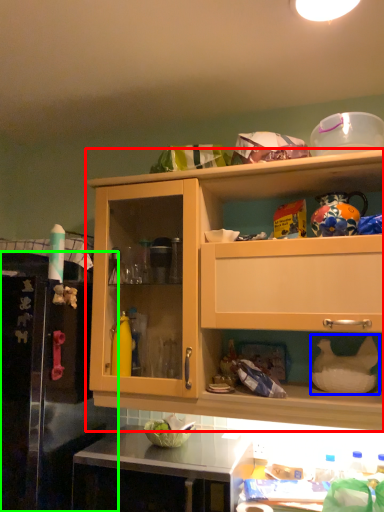
Question: Based on their relative distances, which object is nearer to cabinetry (highlighted by a red box)? Choose from appliance (highlighted by a blue box) and leftover (highlighted by a green box).

Choices:
 (A) appliance
 (B) leftover

Answer: (B)